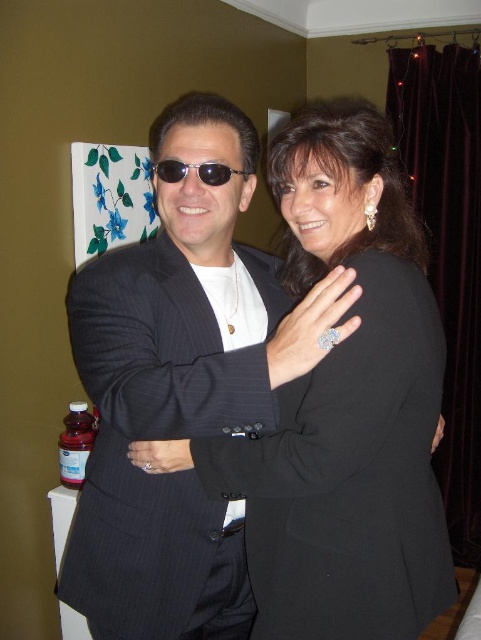
Question: Which point appears farthest from the camera in this image?

Choices:
 (A) (155, 173)
 (B) (250, 387)
 (C) (274, 326)
 (D) (286, 589)

Answer: (C)

Question: Can you confirm if black satin dress at center is smaller than black metallic sunglasses at center?

Choices:
 (A) yes
 (B) no

Answer: (B)

Question: Which object is closer to the camera taking this photo?

Choices:
 (A) pinstriped wool suit at center
 (B) black satin dress at center
 (C) black pinstripe suit at center

Answer: (A)

Question: Is pinstriped wool suit at center wider than black metallic sunglasses at center?

Choices:
 (A) yes
 (B) no

Answer: (A)

Question: Which of the following is the farthest from the observer?

Choices:
 (A) black metallic sunglasses at center
 (B) black pinstripe suit at center

Answer: (A)

Question: Does pinstriped wool suit at center have a lesser width compared to black metallic sunglasses at center?

Choices:
 (A) yes
 (B) no

Answer: (B)